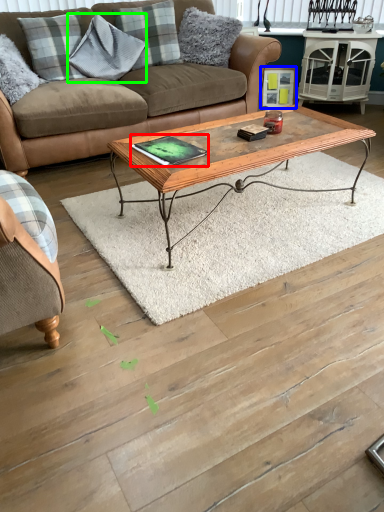
Question: Estimate the real-world distances between objects in this image. Which object is closer to pad (highlighted by a red box), picture frame (highlighted by a blue box) or pillow (highlighted by a green box)?

Choices:
 (A) picture frame
 (B) pillow

Answer: (B)